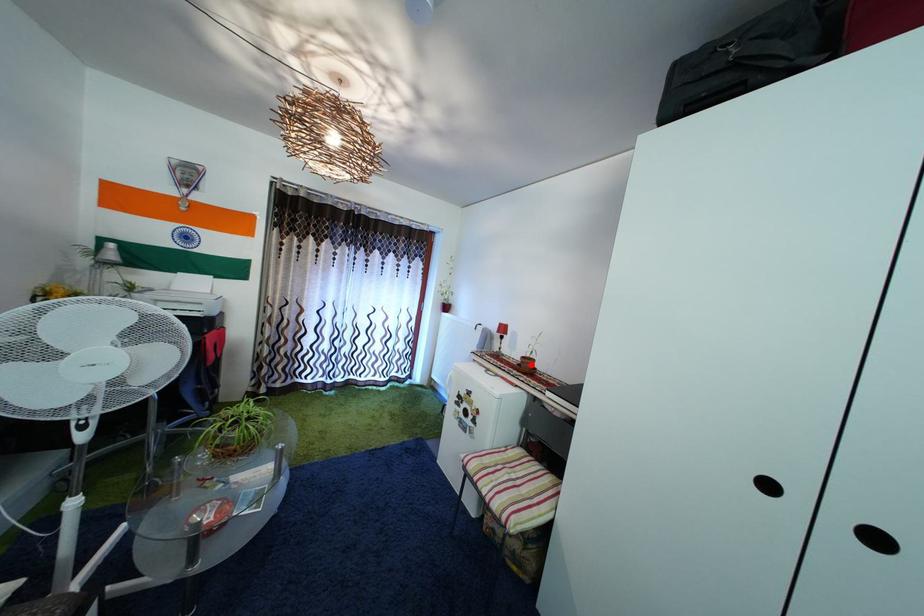
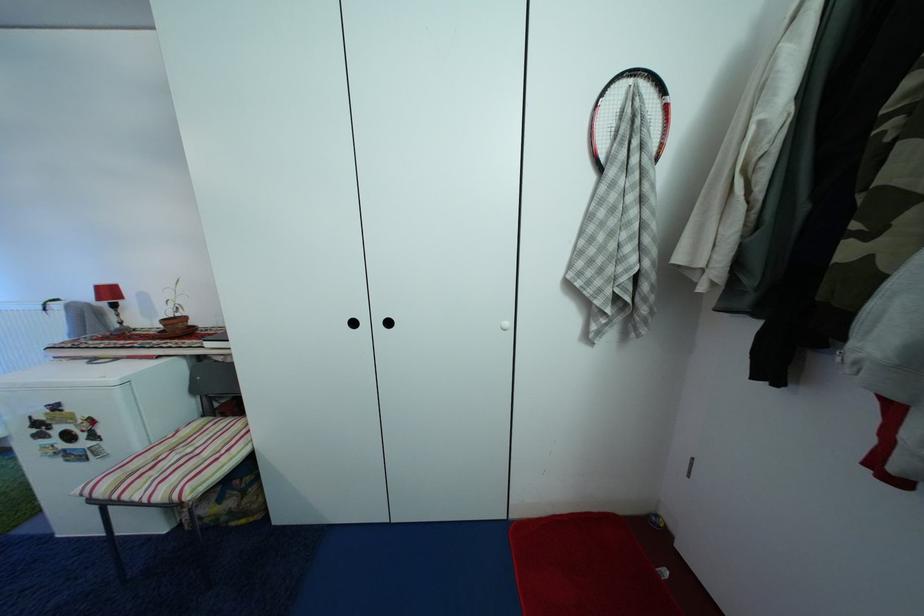
In the second image, find the point that corresponds to the highlighted location in the first image.

(174, 326)